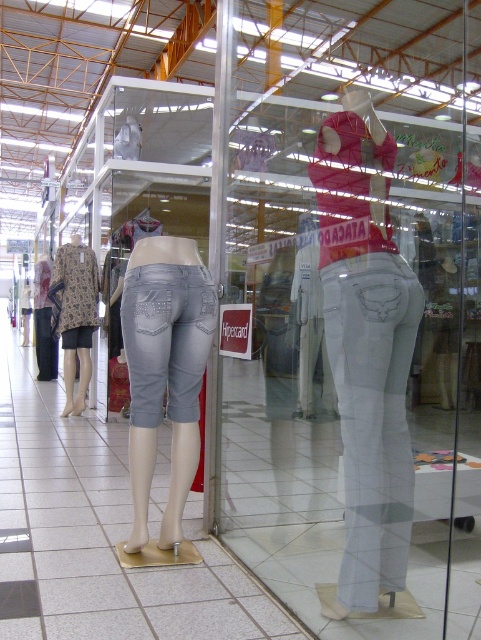
Can you confirm if white denim jeans at center is taller than patterned fabric dress at left?

Incorrect, white denim jeans at center's height is not larger of patterned fabric dress at left's.

Is point (351, 196) closer to viewer compared to point (73, 358)?

Yes, point (351, 196) is closer to viewer.

Locate an element on the screen. The height and width of the screenshot is (640, 481). white denim jeans at center is located at coordinates (354, 365).

Can you confirm if white denim pants at center is taller than denim/cuffed pants at center?

Yes, white denim pants at center is taller than denim/cuffed pants at center.

What do you see at coordinates (367, 348) in the screenshot? The height and width of the screenshot is (640, 481). I see `white denim pants at center` at bounding box center [367, 348].

Which is behind, point (346, 348) or point (188, 337)?

The point (188, 337) is more distant.

You are a GUI agent. You are given a task and a screenshot of the screen. Output one action in this format:
    pyautogui.click(x=<x>, y=<y>)
    Task: Click on the white denim pants at center
    
    Given the screenshot: What is the action you would take?
    pyautogui.click(x=367, y=348)

This screenshot has height=640, width=481. What are the coordinates of `white denim pants at center` in the screenshot? It's located at (367, 348).

The image size is (481, 640). Describe the element at coordinates (367, 348) in the screenshot. I see `white denim pants at center` at that location.

Is point (367, 362) positioned in front of point (85, 285)?

Yes.

This screenshot has width=481, height=640. What are the coordinates of `white denim pants at center` in the screenshot? It's located at (367, 348).